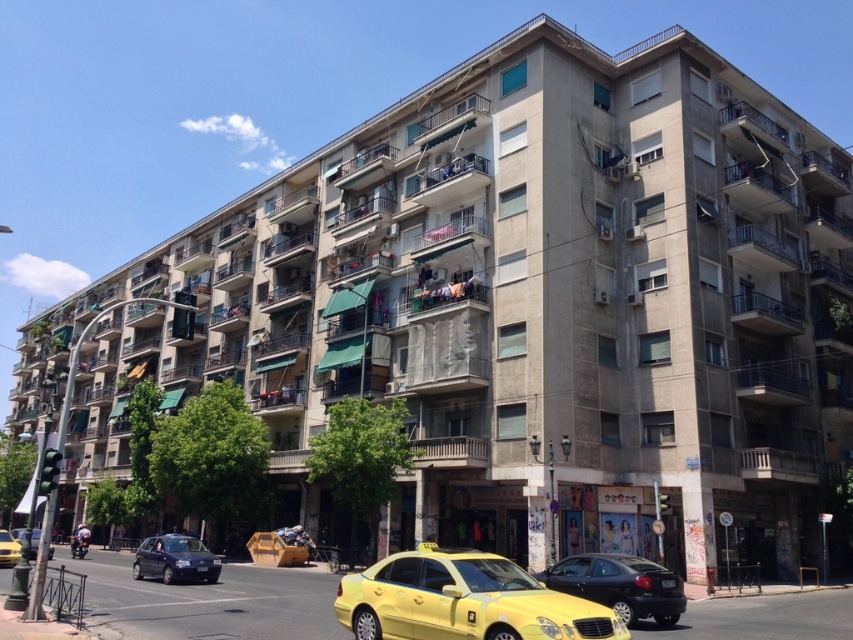
You are a delivery person trying to park your delivery van between the yellow matte taxi at lower center and the yellow metallic taxi at center. Considering the space between them, will your van, which is 3 meters wide, fit in the space?

The yellow matte taxi at lower center is narrower than the yellow metallic taxi at center. However, the space between them isn not specified in the objects description. Therefore, it is impossible to determine if the van will fit based on the given information.

You are standing at the base of the residential building and looking towards the street. There are two points marked in the image. The first point is at coordinate point (192,561) and the second point is at coordinate point (4,531). Which point is closer to you?

Point (192,561) is in front of point (4,531), so the first point is closer to you.

You are standing at the intersection and want to cross the street to reach the building. The traffic light is on the left side of the image. If you look at the dark blue metallic hatchback at lower left, what is its exact position in terms of coordinates?

The dark blue metallic hatchback at lower left is located at coordinates point (175,560).